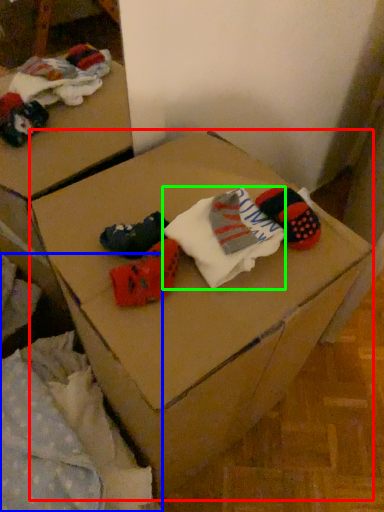
Question: Estimate the real-world distances between objects in this image. Which object is closer to furniture (highlighted by a red box), bedding (highlighted by a blue box) or sock (highlighted by a green box)?

Choices:
 (A) bedding
 (B) sock

Answer: (B)